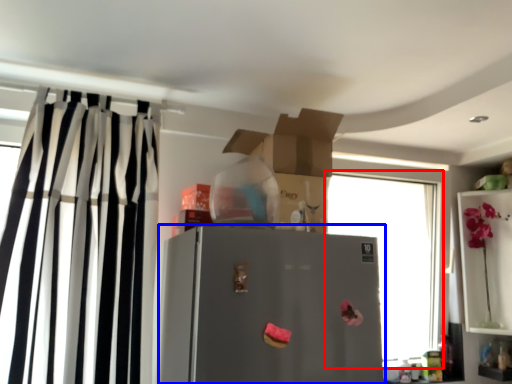
Question: Which object appears farthest to the camera in this image, window (highlighted by a red box) or refrigerator (highlighted by a blue box)?

Choices:
 (A) window
 (B) refrigerator

Answer: (A)